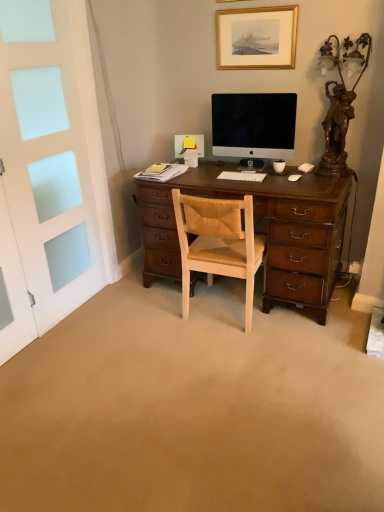
Question: In terms of width, does white matte computer mouse at right, which is the second computer mouse from bottom to top, look wider or thinner when compared to white matte computer mouse at center-right, the second computer mouse when ordered from top to bottom?

Choices:
 (A) thin
 (B) wide

Answer: (B)

Question: Is white matte computer mouse at right, which is the second computer mouse from bottom to top, inside or outside of white matte computer mouse at center-right, the second computer mouse when ordered from top to bottom?

Choices:
 (A) inside
 (B) outside

Answer: (B)

Question: Which is nearer to the white matte computer mouse at center-right, positioned as the second computer mouse in back-to-front order?

Choices:
 (A) white plastic keyboard at center
 (B) white frosted glass screen door at left
 (C) light brown leather chair at center
 (D) gold-framed picture at upper center
 (E) bronze statue at right

Answer: (A)

Question: Which of these objects is positioned closest to the white matte computer mouse at right, the 2th computer mouse when ordered from left to right?

Choices:
 (A) light brown leather chair at center
 (B) white plastic keyboard at center
 (C) satin black monitor at center
 (D) white frosted glass screen door at left
 (E) bronze statue at right

Answer: (C)